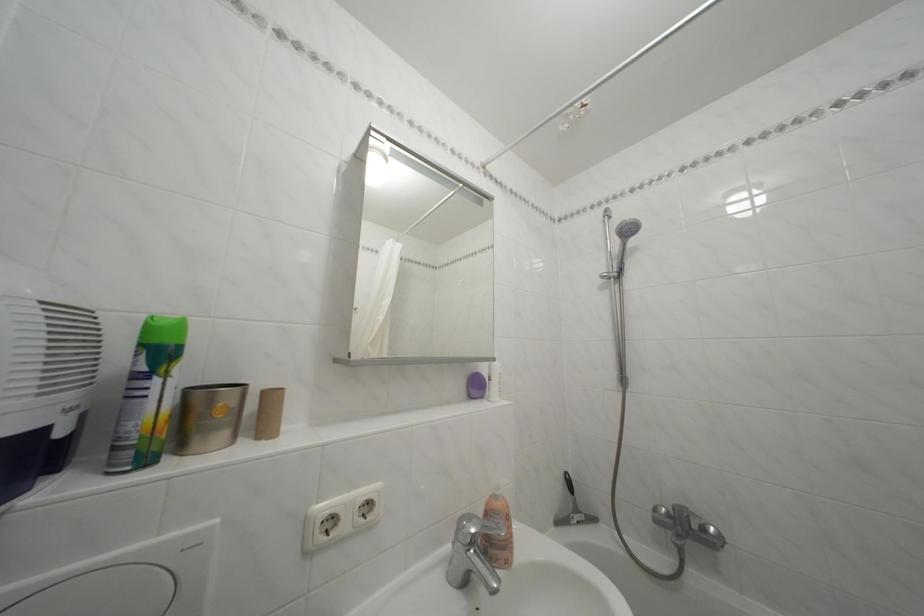
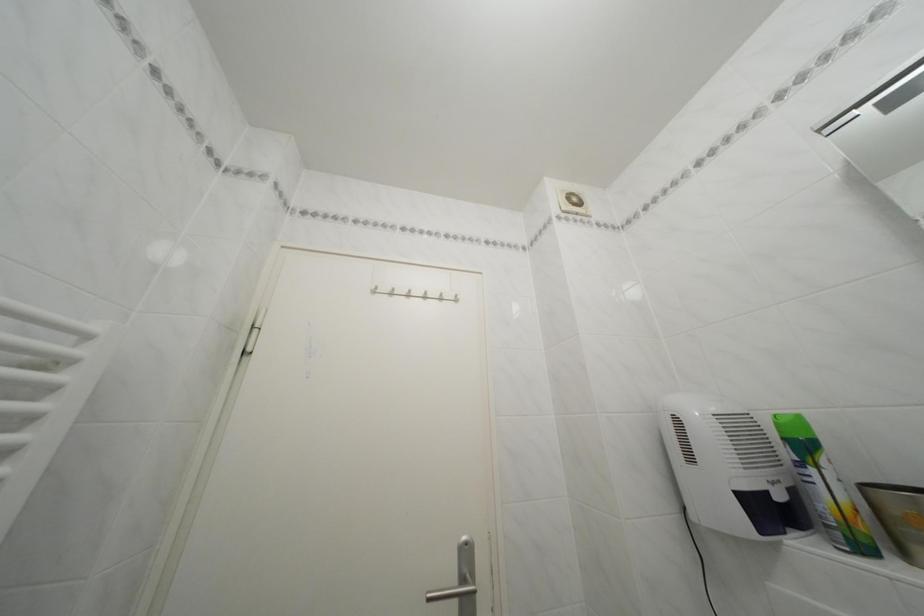
The point at (190, 455) is marked in the first image. Where is the corresponding point in the second image?

(915, 561)